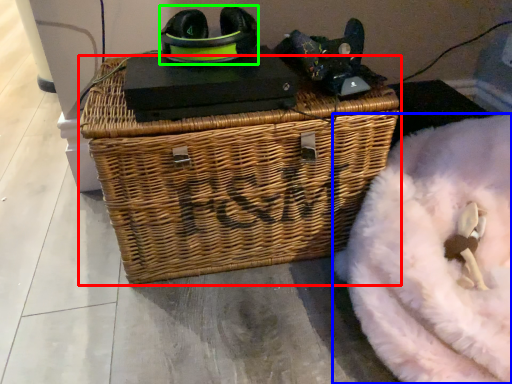
Question: Based on their relative distances, which object is farther from picnic basket (highlighted by a red box)? Choose from bean bag chair (highlighted by a blue box) and shoe (highlighted by a green box).

Choices:
 (A) bean bag chair
 (B) shoe

Answer: (B)